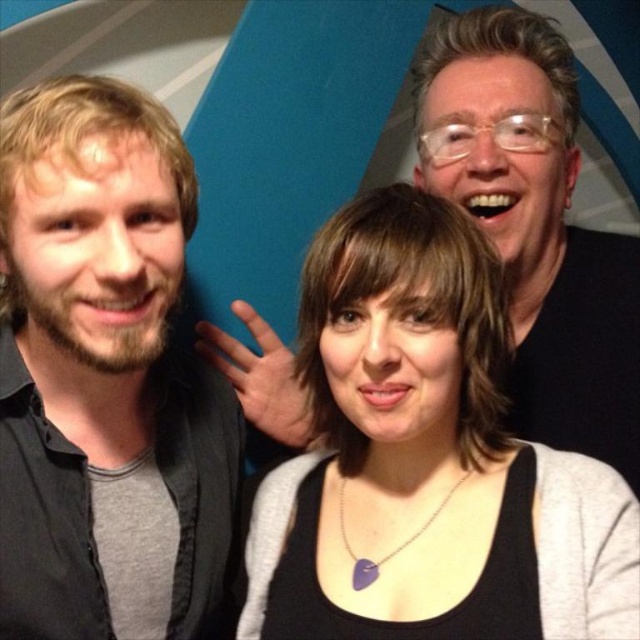
You are a photographer adjusting the lighting for a portrait. You need to ensure that the black matte necklace at center and the matte black shirt at upper right are both properly lit. Which object might require more careful adjustment due to its width?

The black matte necklace at center might require more careful adjustment because it might be wider than the matte black shirt at upper right, potentially creating uneven lighting across its surface.

You are holding a 12 inch ruler and want to measure the distance from your current position to the point at coordinates point (413, 225). How many rulers do you need to cover the distance?

The distance between you and point (413, 225) is 25.50 inches. Since each ruler is 12 inches long, you would need approximately 2 rulers to cover the distance.